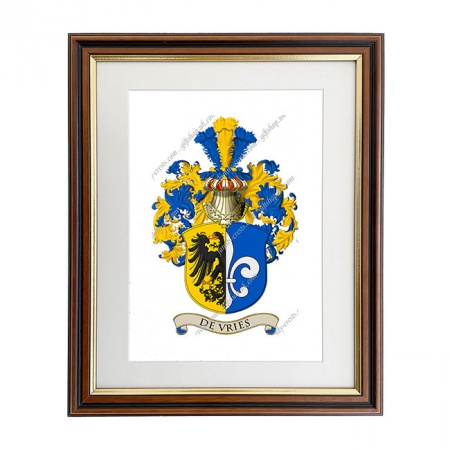
You are a GUI agent. You are given a task and a screenshot of the screen. Output one action in this format:
    pyautogui.click(x=<x>, y=<y>)
    Task: Click on the gold border
    
    Given the screenshot: What is the action you would take?
    pyautogui.click(x=332, y=389)